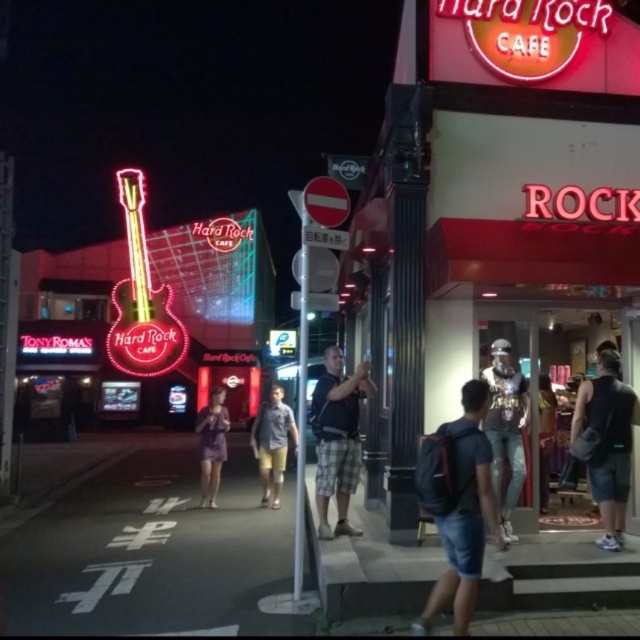
You are standing at the entrance of the Hard Rock Cafe and want to take a photo of the point at coordinate [605,538]. If your camera can focus on objects up to 5 meters away, will it be able to capture that point clearly?

The distance of point [605,538] from viewer is 5.39 meters, which is beyond the camera focus limit of 5 meters. Therefore, the camera will not be able to capture the point clearly.

In the scene shown: You are standing at the entrance of the Hard Rock Cafe and want to place a black fabric backpack at right. Where should you put it so that it aligns with the point at coordinates (605,442)?

The point at coordinates (605,442) corresponds to the black fabric backpack at right, so you should place it there.